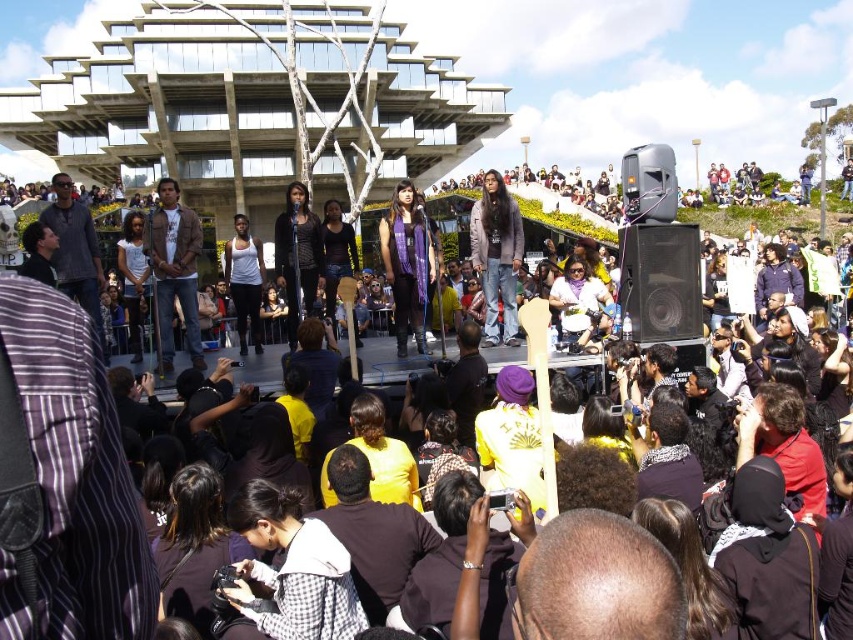
The height and width of the screenshot is (640, 853). Find the location of `matte purple scarf at center`. matte purple scarf at center is located at coordinates (496, 256).

Can you confirm if white matte tank top at center is smaller than matte white shirt at center?

Actually, white matte tank top at center might be larger than matte white shirt at center.

Based on the photo, does white matte tank top at center have a lesser width compared to matte white shirt at center?

Correct, white matte tank top at center's width is less than matte white shirt at center's.

Is point (242, 324) farther from viewer compared to point (584, 310)?

That is True.

This screenshot has height=640, width=853. I want to click on white matte tank top at center, so click(x=245, y=282).

Is black matte speaker at center below purple scarf at center?

Correct, black matte speaker at center is located below purple scarf at center.

Is point (676, 301) in front of point (404, 224)?

Yes, point (676, 301) is in front of point (404, 224).

Is point (622, 228) positioned behind point (416, 259)?

That is False.

At what (x,y) coordinates should I click in order to perform the action: click on black matte speaker at center. Please return your answer as a coordinate pair (x, y). This screenshot has height=640, width=853. Looking at the image, I should click on (659, 282).